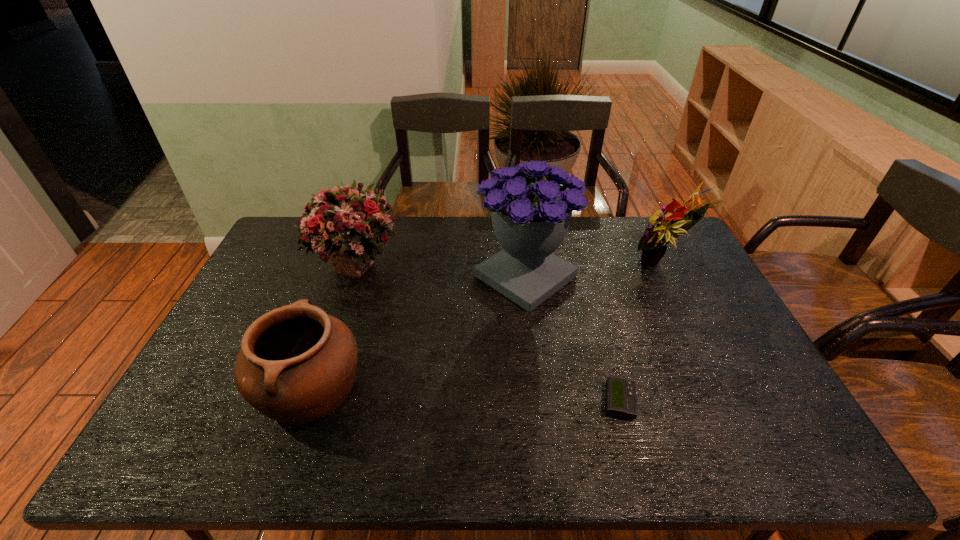
This screenshot has height=540, width=960. In order to click on the tallest bouquet in this screenshot , I will do `click(530, 216)`.

Identify the location of the second bouquet from left to right. pyautogui.click(x=530, y=216).

In order to click on the rightmost object in this screenshot , I will do `click(653, 243)`.

I want to click on the leftmost bouquet, so click(345, 224).

Where is `pottery`? The width and height of the screenshot is (960, 540). pottery is located at coordinates (297, 364).

Locate an element on the screen. beeper is located at coordinates (621, 400).

Where is `free space located on the right of the second bouquet from right to left`? The image size is (960, 540). free space located on the right of the second bouquet from right to left is located at coordinates (604, 276).

You are a GUI agent. You are given a task and a screenshot of the screen. Output one action in this format:
    pyautogui.click(x=<x>, y=<y>)
    Task: Click on the vacant space located 0.080m on the front-facing side of the rightmost object
    The height and width of the screenshot is (540, 960).
    Given the screenshot: What is the action you would take?
    pyautogui.click(x=602, y=265)

This screenshot has height=540, width=960. In order to click on vacant space located 0.150m on the front-facing side of the rightmost object in this screenshot , I will do `click(582, 265)`.

Where is `vacant space located on the front-facing side of the rightmost object`? vacant space located on the front-facing side of the rightmost object is located at coordinates (582, 265).